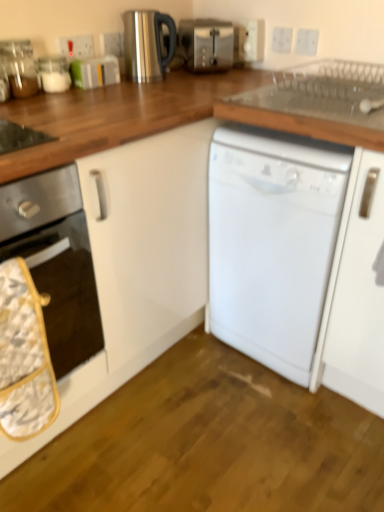
Question: In terms of size, does white glossy oven at left appear bigger or smaller than stainless steel kettle at upper center, the 3th appliance in the left-to-right sequence?

Choices:
 (A) big
 (B) small

Answer: (A)

Question: Considering the positions of point (61, 330) and point (130, 67), is point (61, 330) closer or farther from the camera than point (130, 67)?

Choices:
 (A) closer
 (B) farther

Answer: (A)

Question: Considering the real-world distances, which object is closest to the white plastic electric outlet at upper center, which is counted as the 4th electric outlet, starting from the right?

Choices:
 (A) clear glass jar at upper left, the third appliance viewed from the right
 (B) white plastic electric outlet at upper center, the 2th electric outlet viewed from the right
 (C) white glossy oven at left
 (D) white plastic electric outlet at upper center, marked as the fifth electric outlet in a left-to-right arrangement
 (E) white plastic electric outlet at upper center, which is the fifth electric outlet from right to left

Answer: (E)

Question: Which is nearer to the white plastic electric outlet at upper center, which is the fifth electric outlet from right to left?

Choices:
 (A) white plastic electric outlet at upper center, arranged as the third electric outlet when viewed from the left
 (B) white glossy oven at left
 (C) clear glass jar at upper left, the third appliance viewed from the right
 (D) stainless steel kettle at upper center, positioned as the first appliance in right-to-left order
 (E) white plastic electric outlet at upper center, which appears as the 1th electric outlet when viewed from the right

Answer: (C)